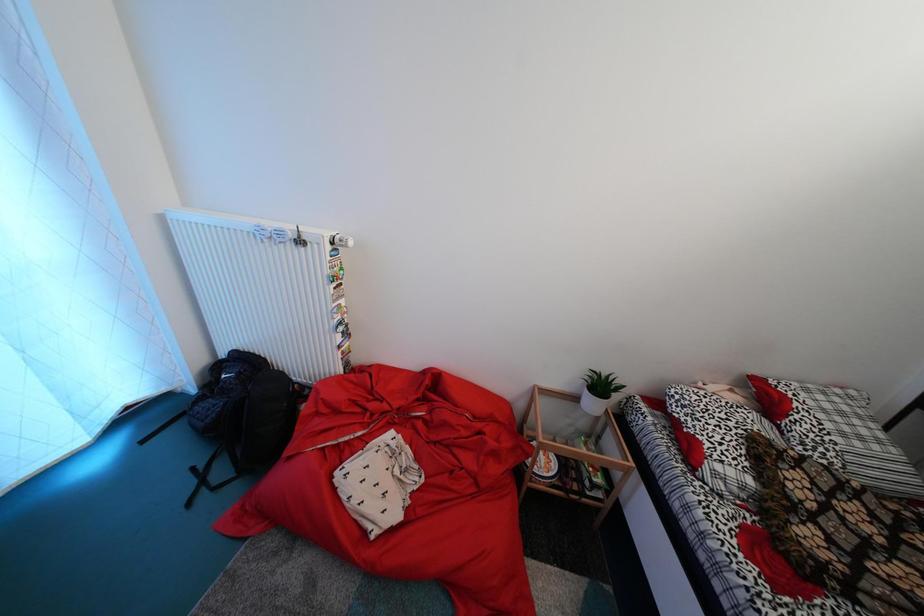
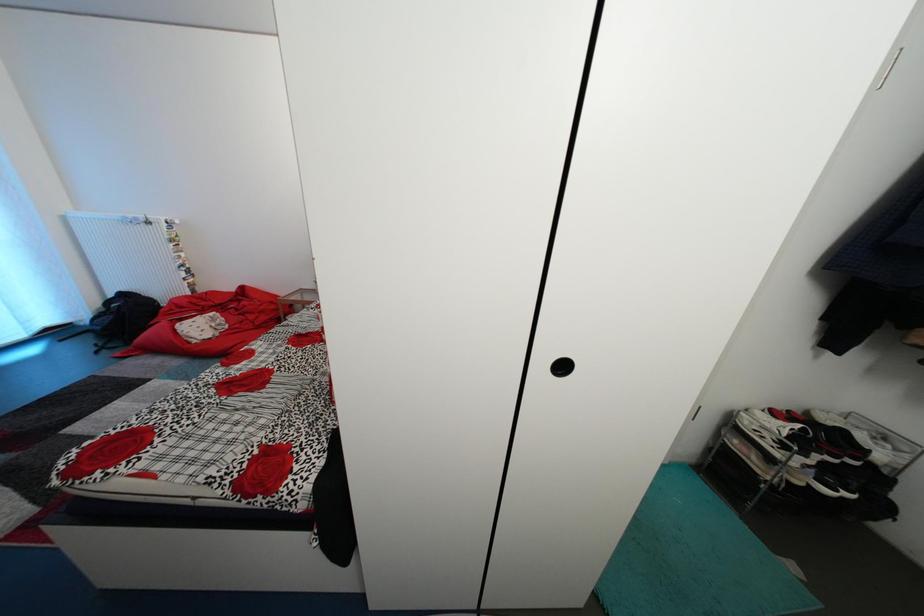
Looking at this image, what movement of the cameraman would produce the second image?

The movement direction of the cameraman is right, backward.